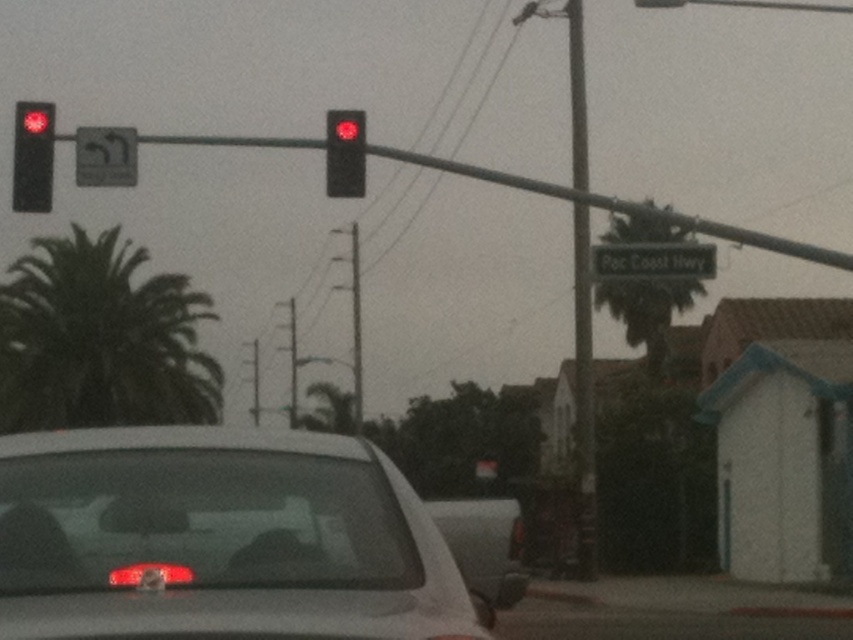
You are a pedestrian standing on the sidewalk. You see the satin white sedan at center and the matte black traffic light at upper left. Which object is nearer to you?

The satin white sedan at center is closer to you than the matte black traffic light at upper left.

You are a delivery driver in a vehicle that is 2 meters wide. You need to pass through an alley that can only accommodate vehicles up to 1.8 meters wide. You see the satin white sedan at center and the matte black traffic light at upper left in the scene. Based on their widths, can you safely navigate the alley?

The satin white sedan at center is thinner than the matte black traffic light at upper left. However, the width of the sedan itself isn not directly compared to the alleyway limit. Since the sedan is thinner than the traffic light, but we don know the traffic light s width, we can t determine if the sedan is within the 1.8 meter limit. Therefore, it s uncertain if you can safely navigate the alley.

You are a delivery driver who needs to turn left onto Pac Coast Hwy. The traffic light is red, and your car is stopped at the intersection. There is a metallic pole at center right marked by point (581, 298). Can you safely turn left without crossing the traffic lane in front of the pole?

The point (581, 298) marks the metallic pole at center right. Since the traffic light is red, you must wait until it turns green before proceeding. Turning left while stopped at a red light is not allowed unless there is a specific sign permitting it. There is a small sign below the traffic light, but its text is not legible. Therefore, it is safest to wait for the green light before attempting to turn left.